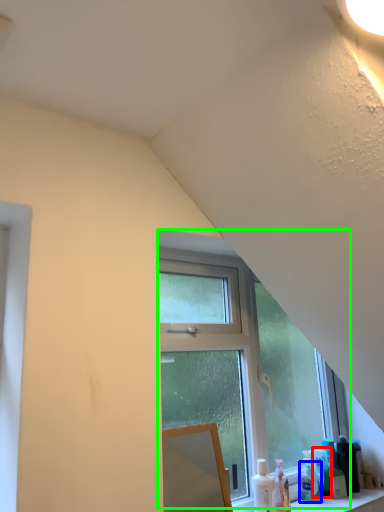
Question: Estimate the real-world distances between objects in this image. Which object is farther from toiletry (highlighted by a red box), toiletry (highlighted by a blue box) or window (highlighted by a green box)?

Choices:
 (A) toiletry
 (B) window

Answer: (B)